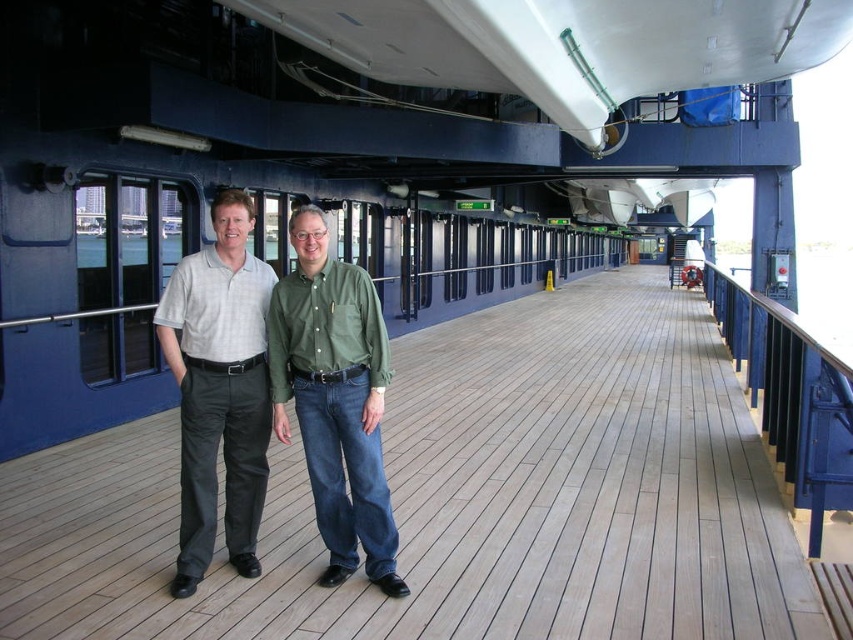
Which is below, wooden at center or gray cotton shirt at center?

wooden at center is below.

Which is above, wooden at center or gray cotton shirt at center?

gray cotton shirt at center is above.

Is point (62, 484) positioned before point (265, 422)?

No, it is not.

Locate an element on the screen. The image size is (853, 640). wooden at center is located at coordinates (459, 499).

Can you confirm if wooden at center is positioned to the left of matte green shirt at center?

Incorrect, wooden at center is not on the left side of matte green shirt at center.

Who is more distant from viewer, (757,556) or (196,273)?

Positioned behind is point (757,556).

Between point (665, 417) and point (198, 561), which one is positioned behind?

The point (665, 417) is behind.

Find the location of a particular element. This screenshot has height=640, width=853. wooden at center is located at coordinates (459, 499).

Is point (212, 497) farther from camera compared to point (263, 493)?

That is False.

Does point (181, 376) come closer to viewer compared to point (234, 396)?

Yes, it is.

Identify the location of matte green shirt at center. tap(219, 388).